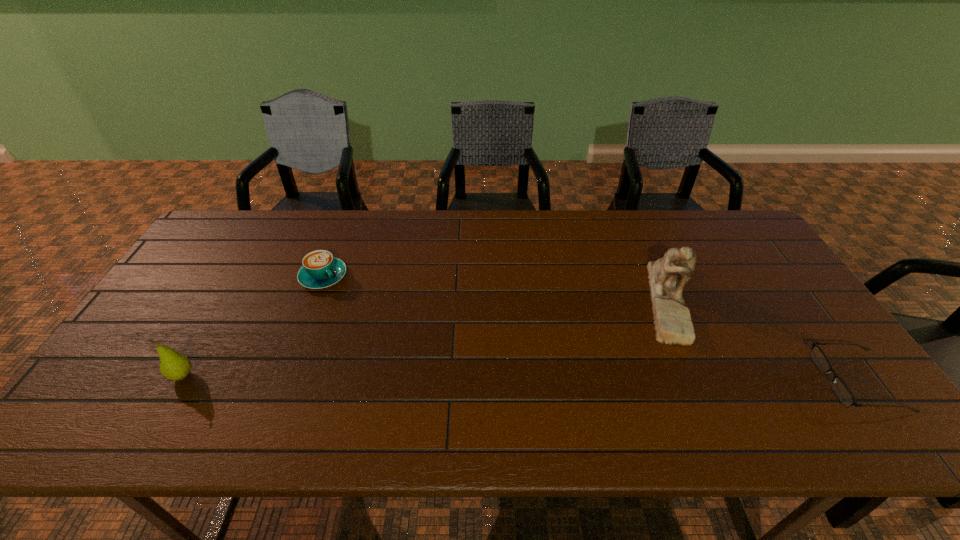
Where is `object located at the left edge`? object located at the left edge is located at coordinates (174, 366).

Find the location of `object located in the right edge section of the desktop`. object located in the right edge section of the desktop is located at coordinates (841, 390).

I want to click on object that is at the near left corner, so click(x=174, y=366).

Where is `object present at the near right corner`? The image size is (960, 540). object present at the near right corner is located at coordinates (841, 390).

Identify the location of vacant space at the far edge. (566, 251).

You are a GUI agent. You are given a task and a screenshot of the screen. Output one action in this format:
    pyautogui.click(x=<x>, y=<y>)
    Task: Click on the vacant space at the near edge of the desktop
    The image size is (960, 540).
    Given the screenshot: What is the action you would take?
    pyautogui.click(x=482, y=398)

In the image, there is a desktop. Identify the location of vacant space at the left edge. The image size is (960, 540). (245, 255).

I want to click on vacant space at the right edge of the desktop, so click(776, 272).

Find the location of a particular element. This screenshot has width=960, height=540. empty location between the pear and the shortest object is located at coordinates (520, 378).

Where is `vacant space that is in between the leftmost object and the third tallest object`? The width and height of the screenshot is (960, 540). vacant space that is in between the leftmost object and the third tallest object is located at coordinates point(253,326).